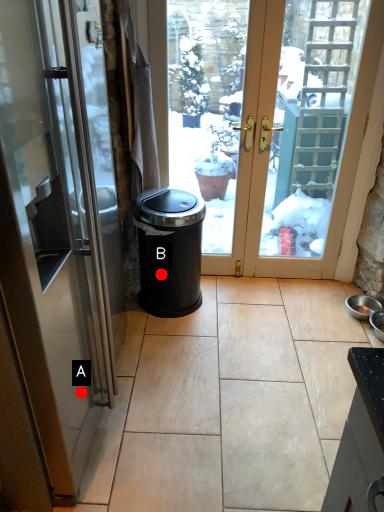
Question: Two points are circled on the image, labeled by A and B beside each circle. Which point appears closest to the camera in this image?

Choices:
 (A) A is closer
 (B) B is closer

Answer: (A)